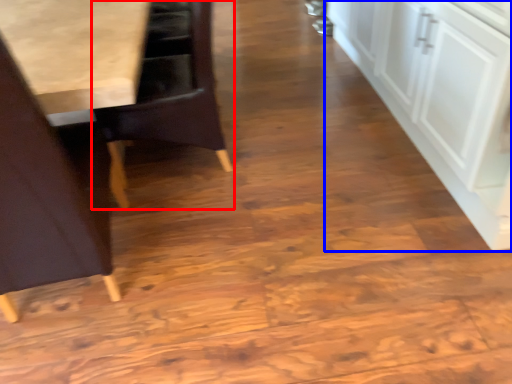
Question: Which of the following is the closest to the observer, chair (highlighted by a red box) or cabinetry (highlighted by a blue box)?

Choices:
 (A) chair
 (B) cabinetry

Answer: (B)